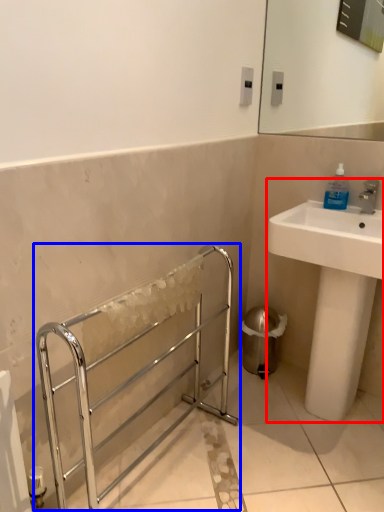
Question: Which of the following is the farthest to the observer, sink (highlighted by a red box) or balustrade (highlighted by a blue box)?

Choices:
 (A) sink
 (B) balustrade

Answer: (A)